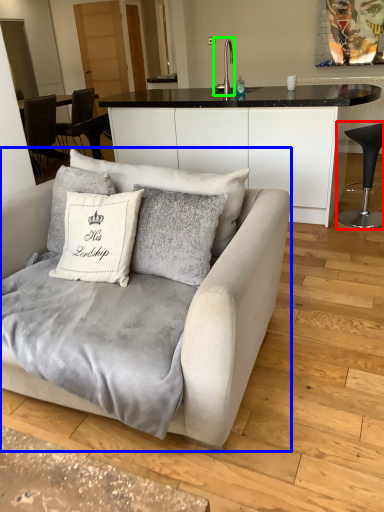
Question: Considering the real-world distances, which object is closest to chair (highlighted by a red box)? studio couch (highlighted by a blue box) or silver (highlighted by a green box).

Choices:
 (A) studio couch
 (B) silver

Answer: (A)